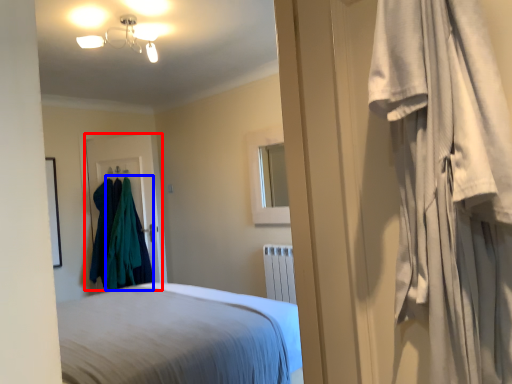
Question: Among these objects, which one is farthest to the camera, door (highlighted by a red box) or clothing (highlighted by a blue box)?

Choices:
 (A) door
 (B) clothing

Answer: (A)